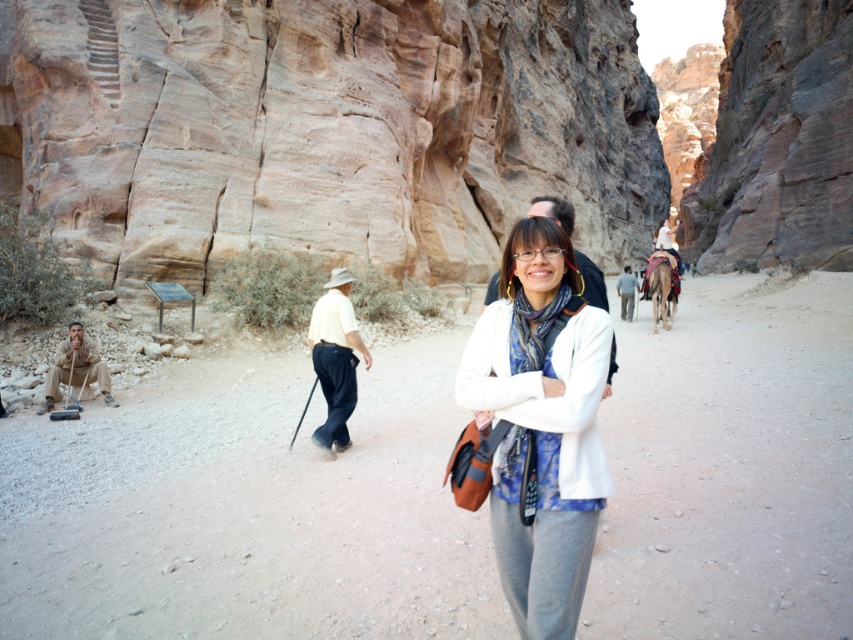
You are a photographer standing at the edge of the canyon. You want to take a photo of the woman wearing the white matte jacket at center. The camera you are using has a maximum focus range of 25 meters. Will the camera be able to focus on her?

The woman wearing the white matte jacket at center is 25.14 meters away. Since the camera can only focus up to 25 meters, it will not be able to focus on her.

You are a photographer planning to take a portrait of the woman in the canyon. You have two props available, a white matte jacket at center and a camouflage fabric uniform at lower left. The client wants the jacket to be more prominent in the photo. Which prop should you place closer to the camera?

To make the white matte jacket at center more prominent, you should place it closer to the camera since it is already positioned below the camouflage fabric uniform at lower left, which might be obscuring or overshadowing it.